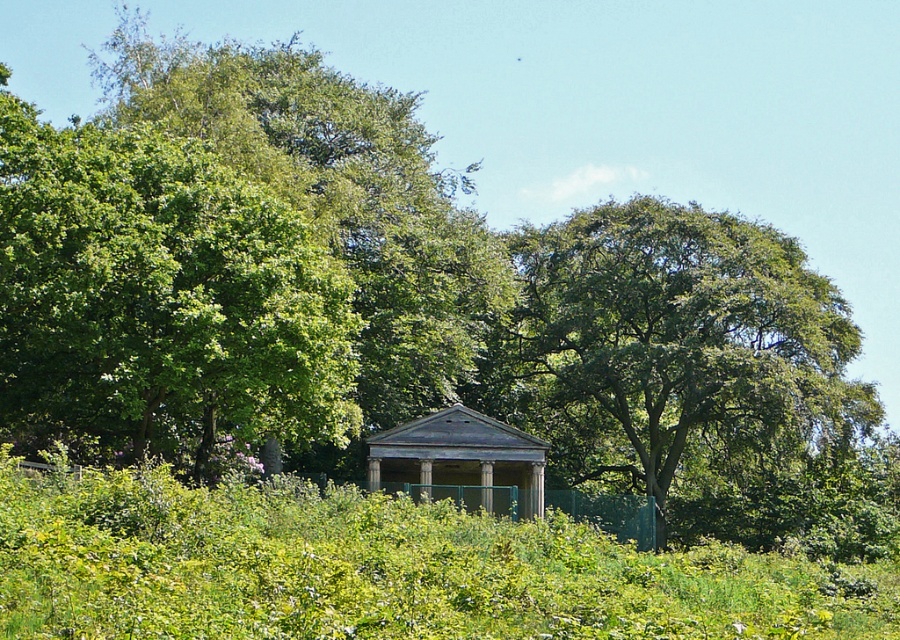
You are standing in the park and want to take a photo of both the green leafy tree at upper left and the weathered wood gazebo at center. Which object should you position closer to the front of your photo to include both in the frame?

To include both the green leafy tree at upper left and the weathered wood gazebo at center in the frame, position the green leafy tree at upper left closer to the front of your photo since it is nearer to the viewer compared to the gazebo.

You are standing in the outdoor scene and want to take a photo of the green leafy tree at upper left. If your camera has a maximum zoom range of 30 meters, will you be able to capture the tree clearly without moving closer?

The green leafy tree at upper left is 35.94 meters away from the viewer. Since the camera can only zoom up to 30 meters, you won not be able to capture the tree clearly without moving closer.